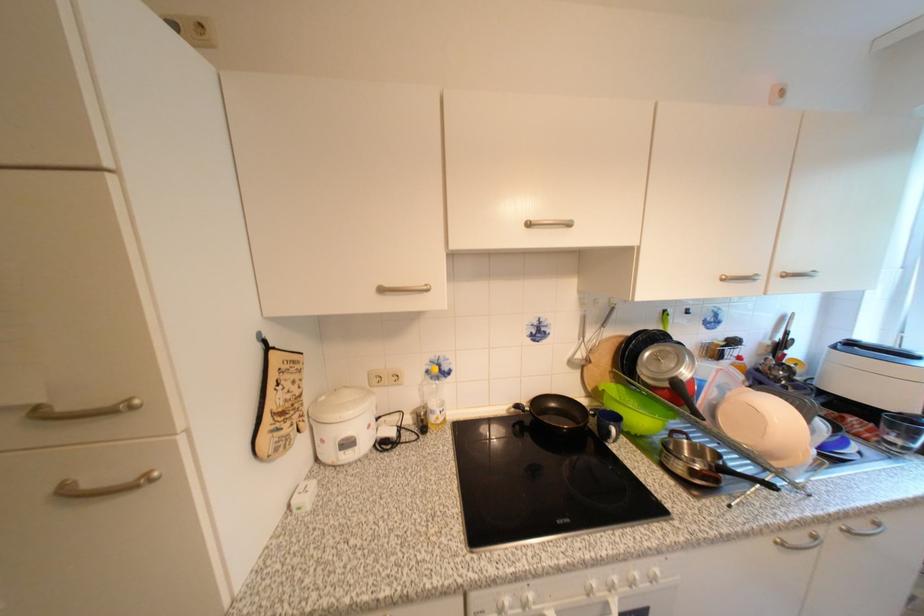
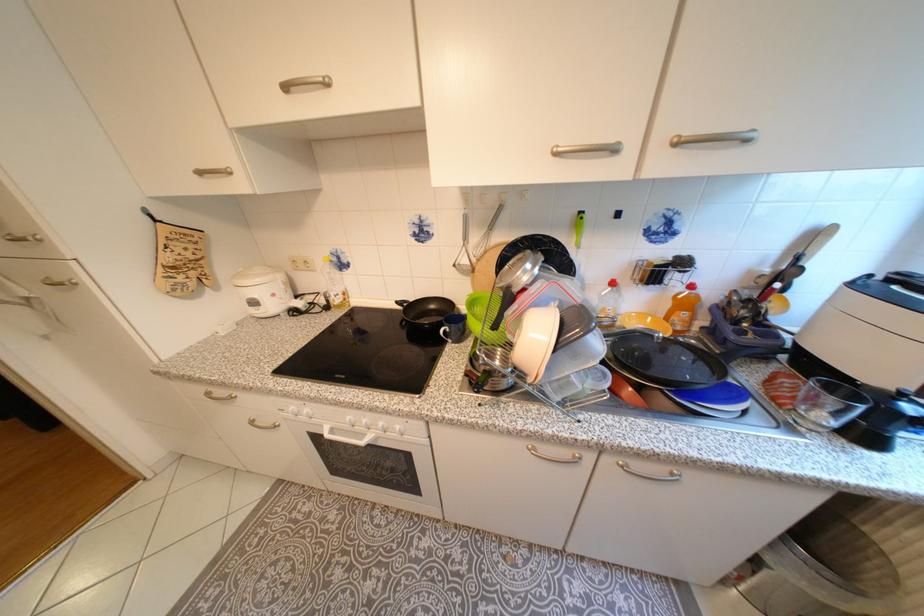
Find the pixel in the second image that matches [302,383] in the first image.

(196, 249)